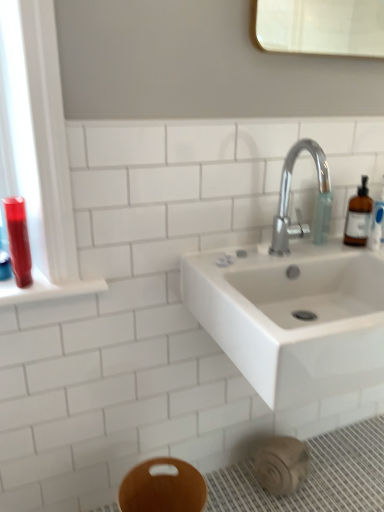
This screenshot has width=384, height=512. Identify the location of vacant area that is in front of translucent plastic soap dispenser at upper right. (321, 251).